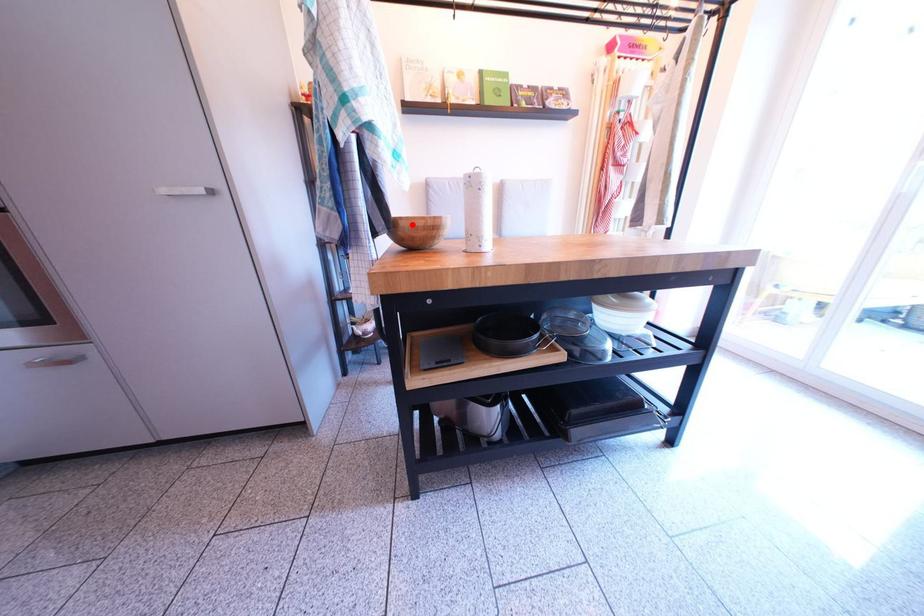
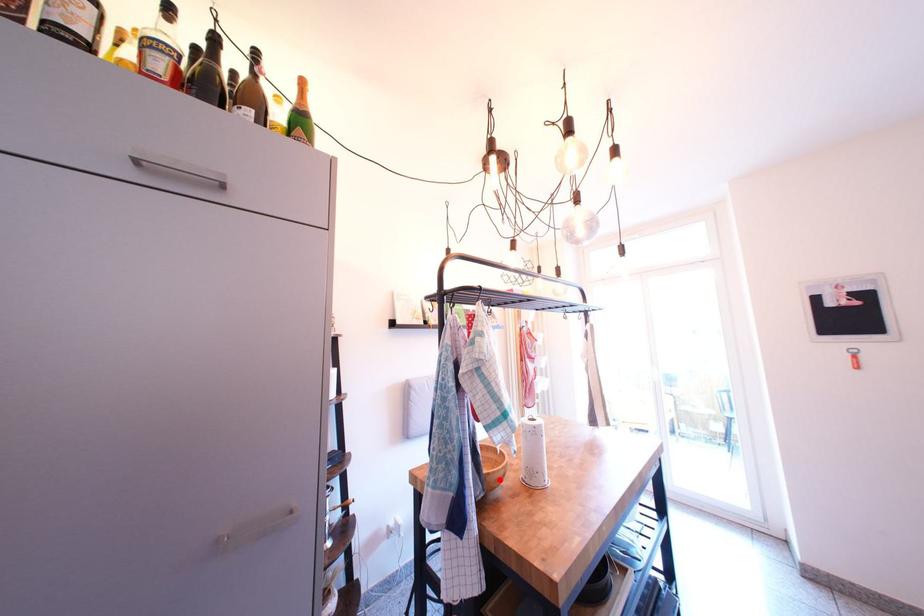
I am providing you with two images of the same scene from different viewpoints. A red point is marked on the first image and another point is marked on the second image. Is the red point in image1 aligned with the point shown in image2?

Yes